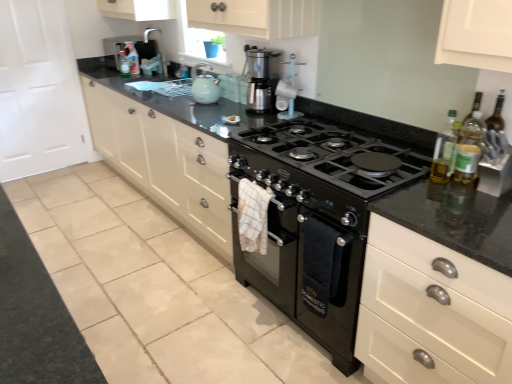
Question: From the image's perspective, is translucent plastic bottle at upper center, the fifth bottle when ordered from right to left, above or below translucent plastic bottle at upper center, which ranks as the 5th bottle in front-to-back order?

Choices:
 (A) above
 (B) below

Answer: (B)

Question: Is point (122, 69) closer or farther from the camera than point (133, 71)?

Choices:
 (A) closer
 (B) farther

Answer: (B)

Question: Which object is positioned closest to the satin silver coffee maker at center?

Choices:
 (A) translucent plastic bottle at upper center, the third bottle positioned from the front
 (B) translucent plastic bottle at right, acting as the 4th bottle starting from the top
 (C) matte white cabinets at center
 (D) translucent plastic bottle at upper center, the fourth bottle from the front
 (E) translucent plastic bottle at upper center, the fifth bottle when ordered from bottom to top

Answer: (C)

Question: Which object is positioned farthest from the matte white cabinets at center?

Choices:
 (A) translucent plastic bottle at upper center, the fourth bottle from the front
 (B) brushed metal faucet at upper center
 (C) translucent plastic bottle at upper center, which is the third bottle from top to bottom
 (D) matte white coffee maker at upper center
 (E) black matte oven at center

Answer: (A)